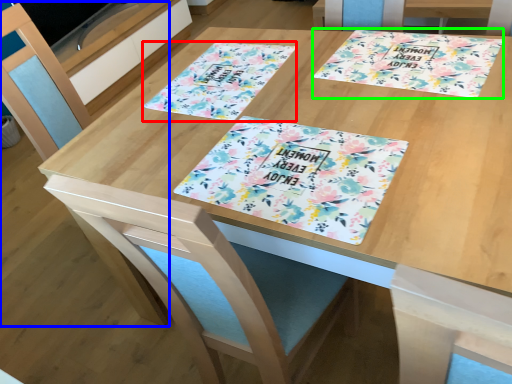
Question: Estimate the real-world distances between objects in this image. Which object is farther from flyer (highlighted by a red box), chair (highlighted by a blue box) or tablecloth (highlighted by a green box)?

Choices:
 (A) chair
 (B) tablecloth

Answer: (A)